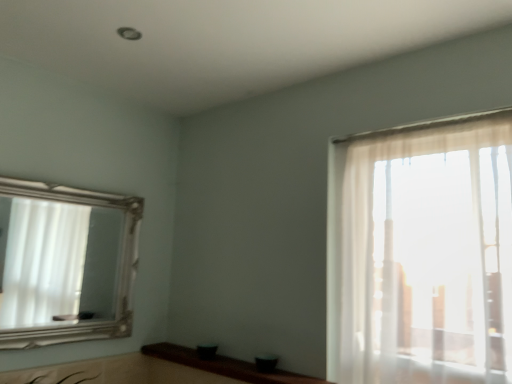
Question: Is silver/golden frame mirror at left wider or thinner than brown wood counter top at lower center?

Choices:
 (A) thin
 (B) wide

Answer: (A)

Question: Based on their positions, is silver/golden frame mirror at left located to the left or right of brown wood counter top at lower center?

Choices:
 (A) right
 (B) left

Answer: (B)

Question: Considering their positions, is silver/golden frame mirror at left located in front of or behind brown wood counter top at lower center?

Choices:
 (A) front
 (B) behind

Answer: (B)

Question: From a real-world perspective, is brown wood counter top at lower center above or below silver/golden frame mirror at left?

Choices:
 (A) below
 (B) above

Answer: (A)

Question: From the image's perspective, relative to silver/golden frame mirror at left, is brown wood counter top at lower center above or below?

Choices:
 (A) below
 (B) above

Answer: (A)

Question: Is brown wood counter top at lower center situated inside silver/golden frame mirror at left or outside?

Choices:
 (A) outside
 (B) inside

Answer: (A)

Question: Is point (229, 375) closer or farther from the camera than point (78, 296)?

Choices:
 (A) closer
 (B) farther

Answer: (A)